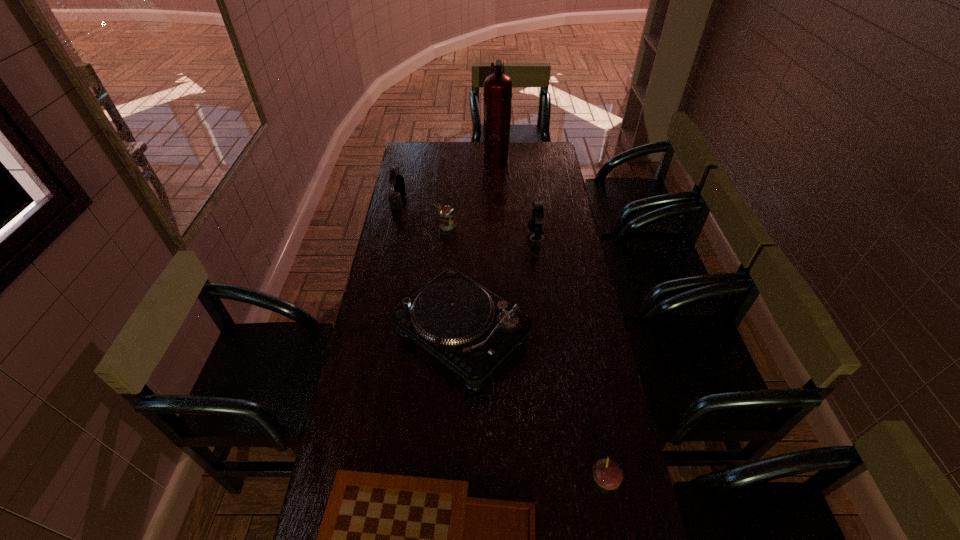
The width and height of the screenshot is (960, 540). Identify the location of earphone that is positioned at the right edge. (535, 224).

The height and width of the screenshot is (540, 960). I want to click on cupcake that is at the right edge, so click(x=607, y=473).

The height and width of the screenshot is (540, 960). In order to click on vacant space at the left edge in this screenshot , I will do `click(383, 264)`.

I want to click on vacant space at the right edge of the desktop, so click(x=582, y=525).

Find the location of a particular element. vacant region at the far right corner of the desktop is located at coordinates (531, 150).

Locate an element on the screen. The width and height of the screenshot is (960, 540). vacant space that's between the can and the fire extinguisher is located at coordinates (471, 190).

Locate an element on the screen. vacant area that lies between the sixth nearest object and the fire extinguisher is located at coordinates (447, 177).

Where is `vacant space that is in between the rightmost object and the second object from right to left`? vacant space that is in between the rightmost object and the second object from right to left is located at coordinates (570, 358).

Find the location of `free space between the rightmost object and the third nearest object`. free space between the rightmost object and the third nearest object is located at coordinates (534, 406).

Locate an element on the screen. This screenshot has height=540, width=960. free point between the record player and the farthest object is located at coordinates (479, 243).